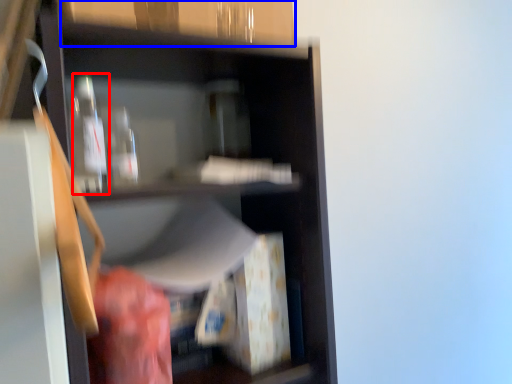
Question: Which object is further to the camera taking this photo, bottle (highlighted by a red box) or cabinetry (highlighted by a blue box)?

Choices:
 (A) bottle
 (B) cabinetry

Answer: (A)